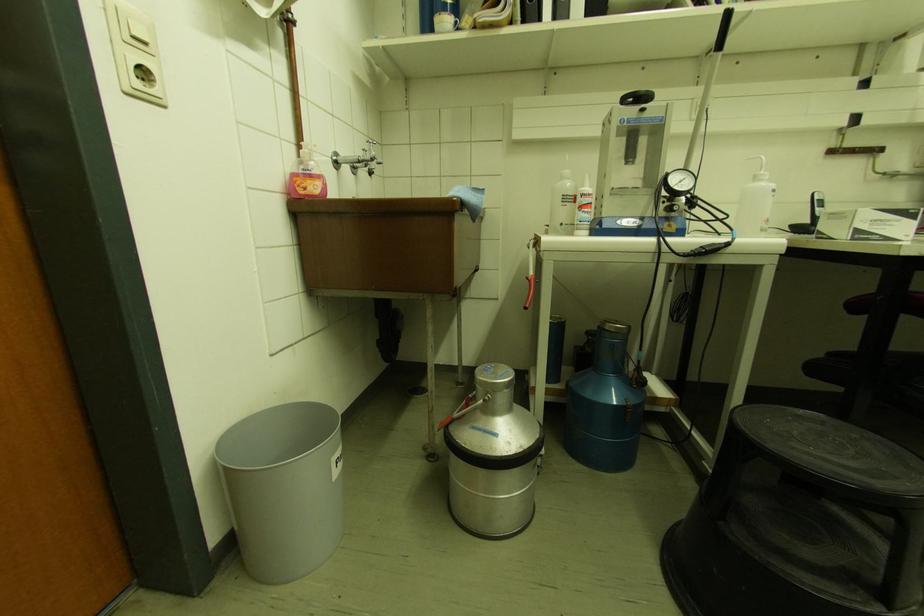
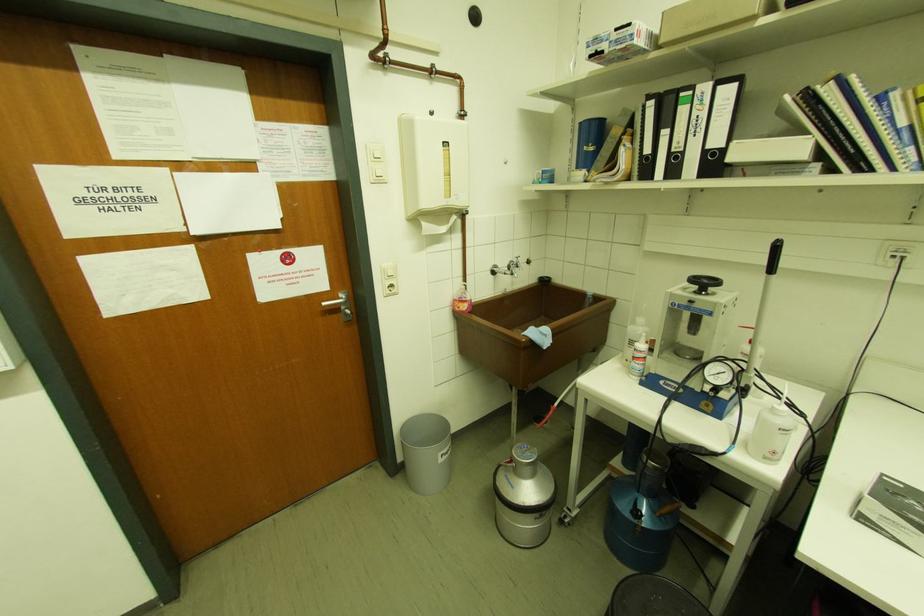
In the second image, find the point that corresponds to (x=341, y=455) in the first image.

(446, 453)